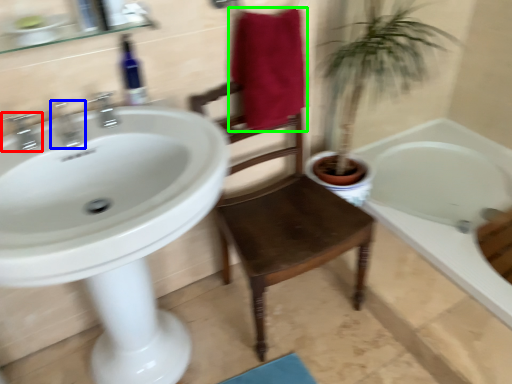
Question: Which object is positioned closest to tap (highlighted by a red box)? Select from tap (highlighted by a blue box) and bath towel (highlighted by a green box).

Choices:
 (A) tap
 (B) bath towel

Answer: (A)